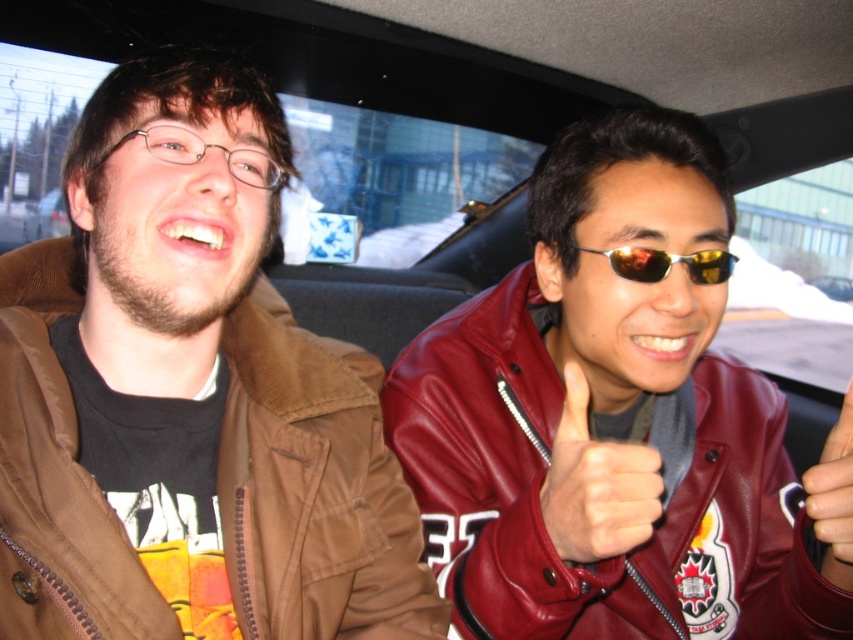
From the picture: Which is more to the right, brown cotton jacket at left or gold reflective sunglasses at center?

gold reflective sunglasses at center is more to the right.

Is brown cotton jacket at left positioned at the back of gold reflective sunglasses at center?

No, brown cotton jacket at left is closer to the viewer.

Who is more distant from viewer, (10, 595) or (729, 259)?

Point (729, 259)

Locate an element on the screen. brown cotton jacket at left is located at coordinates (189, 396).

Is shiny maroon leather jacket at right to the right of leather at center from the viewer's perspective?

Yes, shiny maroon leather jacket at right is to the right of leather at center.

Can you confirm if shiny maroon leather jacket at right is bigger than leather at center?

Yes, shiny maroon leather jacket at right is bigger than leather at center.

Measure the distance between shiny maroon leather jacket at right and camera.

shiny maroon leather jacket at right and camera are 24.18 inches apart.

At what (x,y) coordinates should I click in order to perform the action: click on shiny maroon leather jacket at right. Please return your answer as a coordinate pair (x, y). This screenshot has height=640, width=853. Looking at the image, I should click on (544, 476).

Where is `brown cotton jacket at left`? The height and width of the screenshot is (640, 853). brown cotton jacket at left is located at coordinates (189, 396).

Based on the photo, does brown cotton jacket at left have a larger size compared to shiny maroon leather jacket at right?

Incorrect, brown cotton jacket at left is not larger than shiny maroon leather jacket at right.

Identify the location of brown cotton jacket at left. (189, 396).